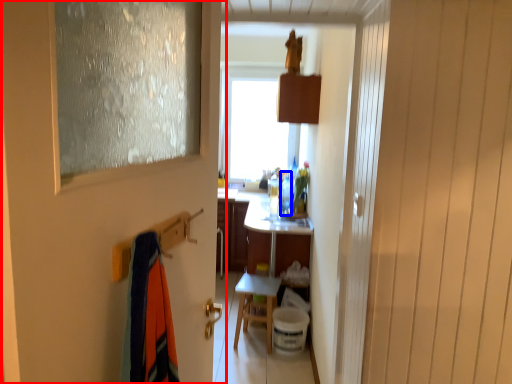
Question: Among these objects, which one is farthest to the camera, door (highlighted by a red box) or bottle (highlighted by a blue box)?

Choices:
 (A) door
 (B) bottle

Answer: (B)